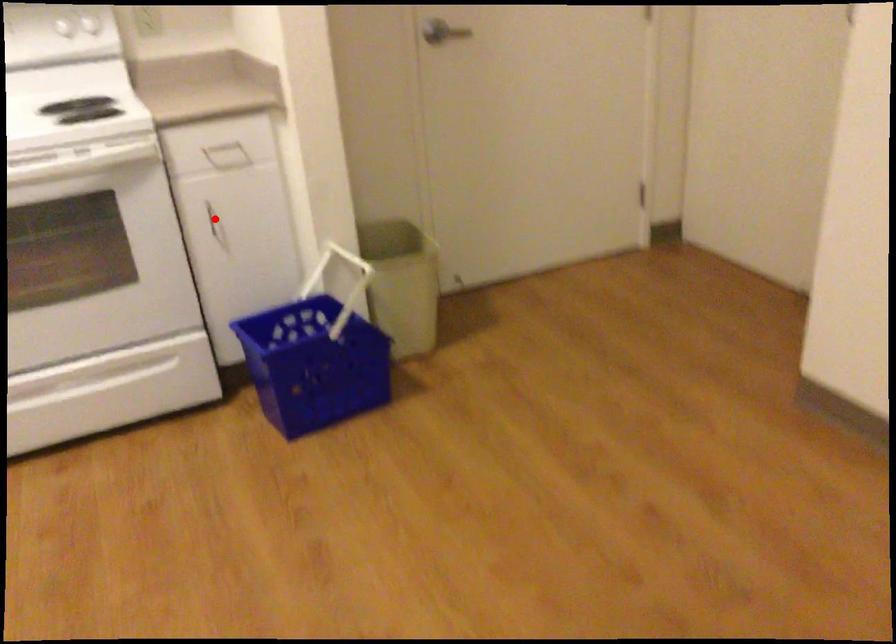
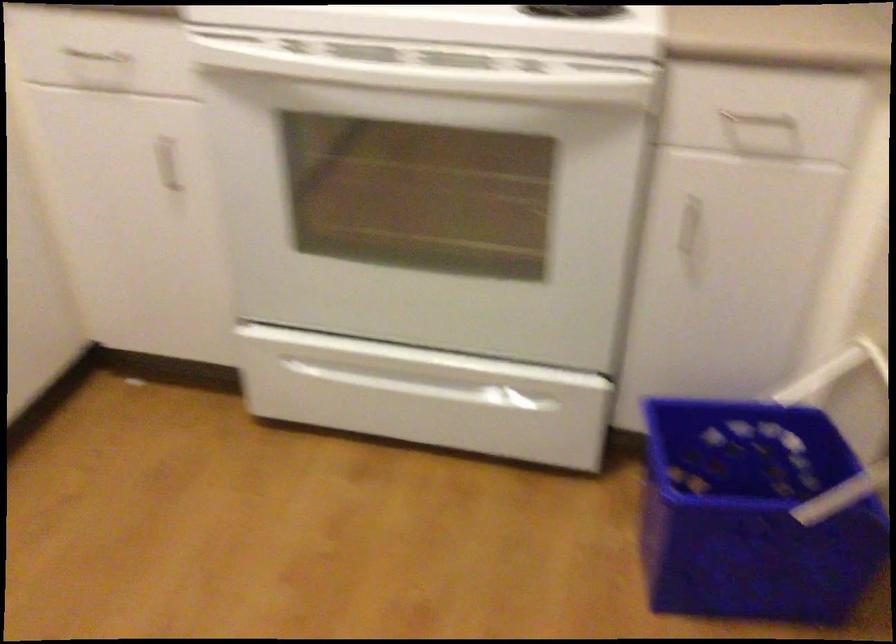
Question: I am providing you with two images of the same scene from different viewpoints. In image1, a red point is highlighted. Considering the same 3D point in image2, which of the following is correct?

Choices:
 (A) It is closer
 (B) It is farther

Answer: (A)